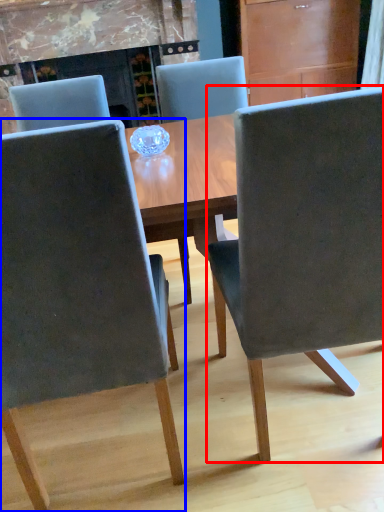
Question: Which point is further to the camera, chair (highlighted by a red box) or chair (highlighted by a blue box)?

Choices:
 (A) chair
 (B) chair

Answer: (A)